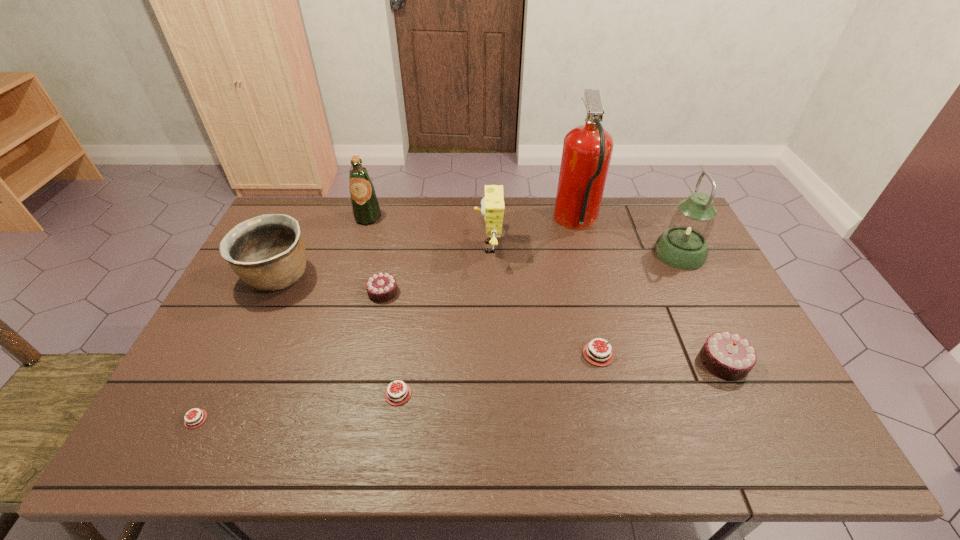
Where is `the sixth tallest object`? The image size is (960, 540). the sixth tallest object is located at coordinates (727, 355).

You are a GUI agent. You are given a task and a screenshot of the screen. Output one action in this format:
    pyautogui.click(x=<x>, y=<y>)
    Task: Click on the left chocolate chocolate cake
    
    Given the screenshot: What is the action you would take?
    pyautogui.click(x=381, y=287)

In order to click on the fourth shortest object in this screenshot , I will do `click(381, 287)`.

Image resolution: width=960 pixels, height=540 pixels. I want to click on the biggest red chocolate cake, so click(603, 357).

The image size is (960, 540). I want to click on the rightmost red chocolate cake, so click(x=603, y=357).

Locate an element on the screen. This screenshot has height=540, width=960. the second biggest red chocolate cake is located at coordinates (397, 395).

Find the location of a particular element. This screenshot has width=960, height=540. the second red chocolate cake from left to right is located at coordinates (397, 395).

The height and width of the screenshot is (540, 960). Identify the location of the shortest chocolate cake. coord(188,423).

Locate an element on the screen. the leftmost chocolate cake is located at coordinates point(188,423).

Identify the location of blank area located 0.060m with the handle and nozzle on the red fire extinguisher. The image size is (960, 540). (538, 223).